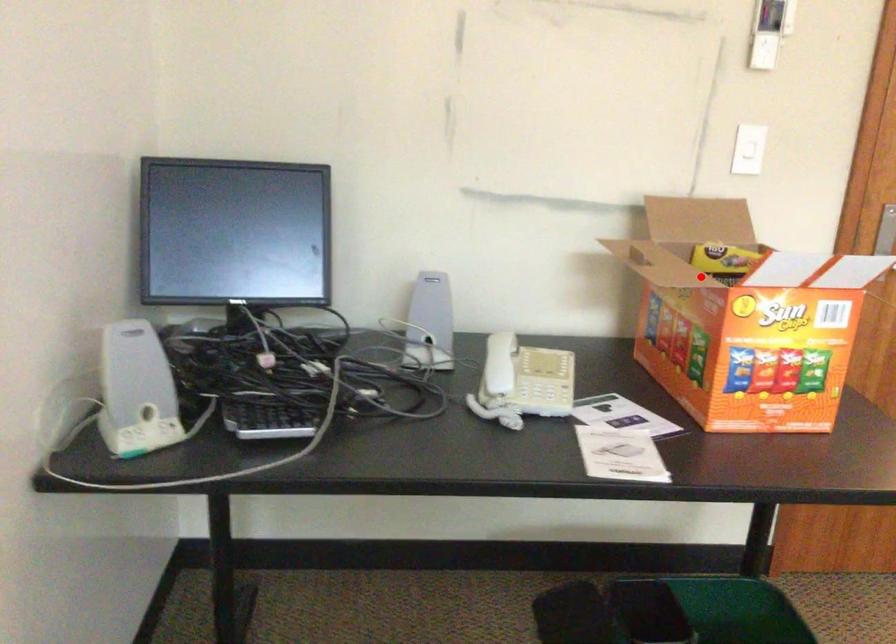
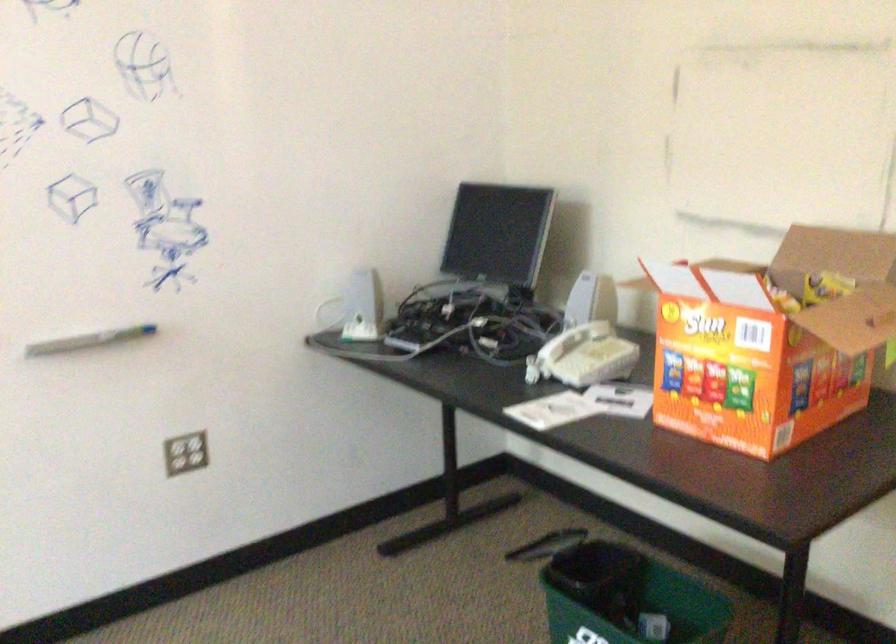
In the second image, find the point that corresponds to the highlighted location in the first image.

(782, 301)